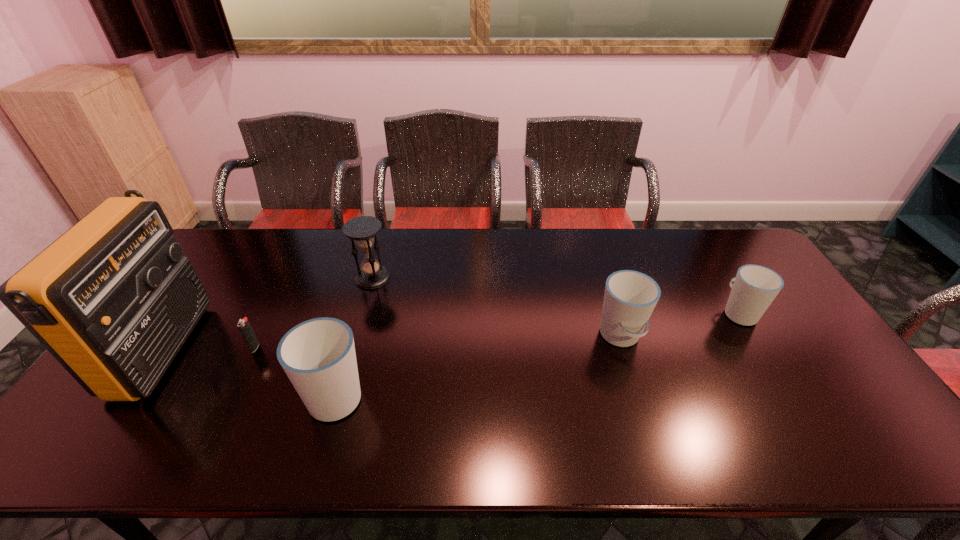
You are a GUI agent. You are given a task and a screenshot of the screen. Output one action in this format:
    pyautogui.click(x=<x>, y=<y>)
    Task: Click on the object that is at the far edge
    The width and height of the screenshot is (960, 540).
    Given the screenshot: What is the action you would take?
    pyautogui.click(x=362, y=230)

Locate an element on the screen. The height and width of the screenshot is (540, 960). cup that is positioned at the near edge is located at coordinates (318, 355).

What are the coordinates of `radio receiver that is at the near edge` in the screenshot? It's located at (113, 299).

The width and height of the screenshot is (960, 540). In order to click on object that is at the left edge in this screenshot , I will do `click(113, 299)`.

Image resolution: width=960 pixels, height=540 pixels. I want to click on object that is at the right edge, so click(x=755, y=287).

Identify the location of object positioned at the near left corner. (113, 299).

In the image, there is a desktop. What are the coordinates of `free space at the far edge` in the screenshot? It's located at (404, 265).

This screenshot has width=960, height=540. I want to click on vacant region at the near edge of the desktop, so click(652, 420).

In the image, there is a desktop. Identify the location of free region at the far left corner. The width and height of the screenshot is (960, 540). (215, 240).

Image resolution: width=960 pixels, height=540 pixels. I want to click on vacant space at the far right corner, so pyautogui.click(x=719, y=237).